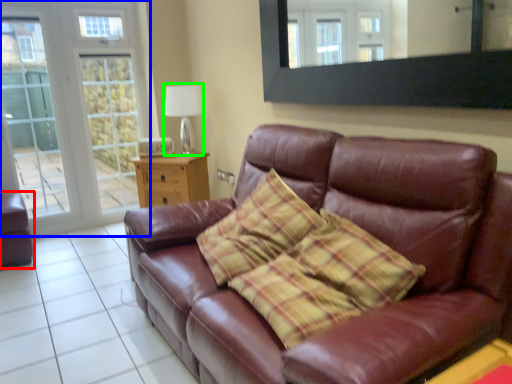
Question: Which object is the closest to the armchair (highlighted by a red box)? Choose among these: glass door (highlighted by a blue box) or lamp (highlighted by a green box).

Choices:
 (A) glass door
 (B) lamp

Answer: (A)